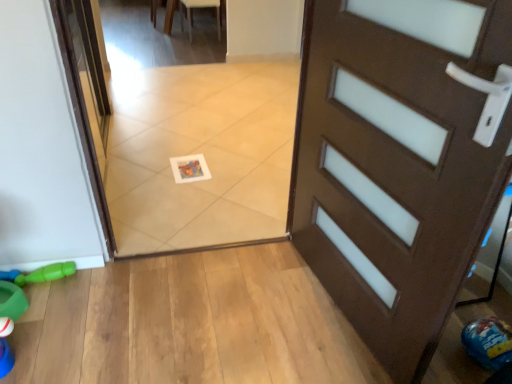
This screenshot has height=384, width=512. Describe the element at coordinates (190, 13) in the screenshot. I see `white leather chair at upper center` at that location.

Where is `white leather chair at upper center`? The width and height of the screenshot is (512, 384). white leather chair at upper center is located at coordinates (190, 13).

What do you see at coordinates (47, 273) in the screenshot?
I see `green rubber toy at lower left` at bounding box center [47, 273].

Find the location of `green rubber toy at lower left`. green rubber toy at lower left is located at coordinates (47, 273).

Locate an element on the screen. This screenshot has height=384, width=512. white leather chair at upper center is located at coordinates (190, 13).

Would you say white leather chair at upper center is to the left or to the right of green rubber toy at lower left in the picture?

white leather chair at upper center is to the right of green rubber toy at lower left.

Considering the positions of objects white leather chair at upper center and green rubber toy at lower left in the image provided, who is behind, white leather chair at upper center or green rubber toy at lower left?

Positioned behind is white leather chair at upper center.

Which is less distant, (170, 29) or (60, 266)?

Clearly, point (170, 29) is more distant from the camera than point (60, 266).

From the image's perspective, between white leather chair at upper center and green rubber toy at lower left, which one is located above?

white leather chair at upper center is shown above in the image.

From a real-world perspective, relative to green rubber toy at lower left, is white leather chair at upper center vertically above or below?

From a real-world perspective, white leather chair at upper center is physically above green rubber toy at lower left.

Considering the relative sizes of white leather chair at upper center and green rubber toy at lower left in the image provided, is white leather chair at upper center wider than green rubber toy at lower left?

Indeed, white leather chair at upper center has a greater width compared to green rubber toy at lower left.

Who is shorter, white leather chair at upper center or green rubber toy at lower left?

With less height is green rubber toy at lower left.

Is white leather chair at upper center smaller than green rubber toy at lower left?

Actually, white leather chair at upper center might be larger than green rubber toy at lower left.

Is white leather chair at upper center inside the boundaries of green rubber toy at lower left, or outside?

white leather chair at upper center is outside green rubber toy at lower left.

Would you say white leather chair at upper center is a long distance from green rubber toy at lower left?

Yes, white leather chair at upper center is far from green rubber toy at lower left.

Is white leather chair at upper center oriented away from green rubber toy at lower left?

Yes, white leather chair at upper center is facing away from green rubber toy at lower left.

Where is `chair lying behind the green rubber toy at lower left`? chair lying behind the green rubber toy at lower left is located at coordinates (x=190, y=13).

Which is more to the left, green rubber toy at lower left or white leather chair at upper center?

From the viewer's perspective, green rubber toy at lower left appears more on the left side.

Which object is further away from the camera, green rubber toy at lower left or white leather chair at upper center?

white leather chair at upper center is further from the camera.

Considering the points (60, 271) and (210, 1), which point is in front, point (60, 271) or point (210, 1)?

The point (60, 271) is more forward.

From the image's perspective, is green rubber toy at lower left located above or below white leather chair at upper center?

From the image's perspective, green rubber toy at lower left appears below white leather chair at upper center.

From a real-world perspective, is green rubber toy at lower left located higher than white leather chair at upper center?

No, from a real-world perspective, green rubber toy at lower left is not on top of white leather chair at upper center.

Considering the sizes of objects green rubber toy at lower left and white leather chair at upper center in the image provided, who is thinner, green rubber toy at lower left or white leather chair at upper center?

Thinner between the two is green rubber toy at lower left.

Between green rubber toy at lower left and white leather chair at upper center, which one has more height?

Standing taller between the two is white leather chair at upper center.

Can you confirm if green rubber toy at lower left is bigger than white leather chair at upper center?

No, green rubber toy at lower left is not bigger than white leather chair at upper center.

Is green rubber toy at lower left not within white leather chair at upper center?

green rubber toy at lower left lies outside white leather chair at upper center's area.

Is green rubber toy at lower left far from white leather chair at upper center?

That's right, there is a large distance between green rubber toy at lower left and white leather chair at upper center.

Is white leather chair at upper center at the back of green rubber toy at lower left?

Correct, green rubber toy at lower left is looking away from white leather chair at upper center.

Can you tell me how much green rubber toy at lower left and white leather chair at upper center differ in facing direction?

178 degrees separate the facing orientations of green rubber toy at lower left and white leather chair at upper center.

Where is `chair above the green rubber toy at lower left (from a real-world perspective)`? The image size is (512, 384). chair above the green rubber toy at lower left (from a real-world perspective) is located at coordinates (190, 13).

At what (x,y) coordinates should I click in order to perform the action: click on toy on the left of the white leather chair at upper center. Please return your answer as a coordinate pair (x, y). The image size is (512, 384). Looking at the image, I should click on (47, 273).

Image resolution: width=512 pixels, height=384 pixels. In order to click on chair behind the green rubber toy at lower left in this screenshot , I will do `click(190, 13)`.